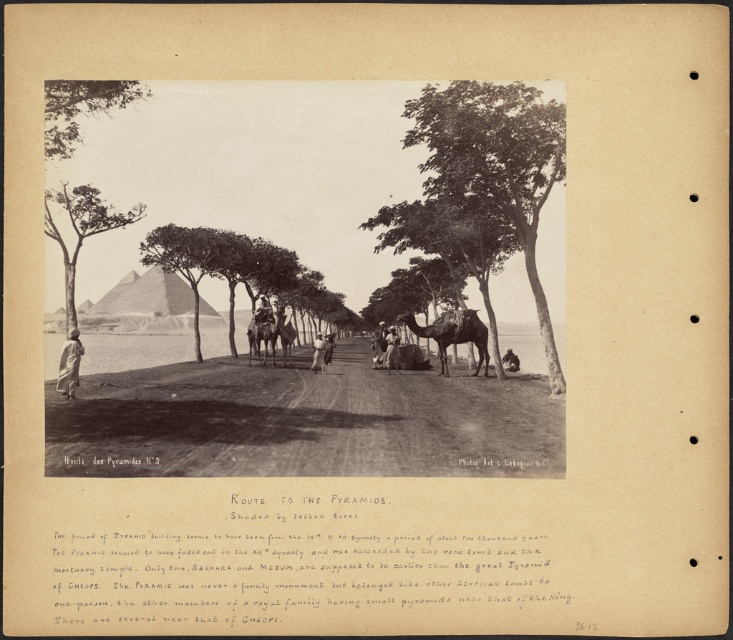
Question: Does smooth bark tree at center appear under dark brown leather camel at center?

Choices:
 (A) yes
 (B) no

Answer: (B)

Question: Observing the image, what is the correct spatial positioning of brown leather horse at center in reference to dark brown leather camel at center?

Choices:
 (A) above
 (B) below

Answer: (A)

Question: Which point is farther to the camera?

Choices:
 (A) brown leather horse at center
 (B) smooth bark tree at center

Answer: (B)

Question: Which of these objects is positioned farthest from the smooth bark tree at center?

Choices:
 (A) green leafy tree at upper left
 (B) green leafy tree at center
 (C) brown leather horse at center

Answer: (A)

Question: Does green leafy tree at upper left have a smaller size compared to green leafy tree at left?

Choices:
 (A) yes
 (B) no

Answer: (A)

Question: Which of the following is the closest to the observer?

Choices:
 (A) (320, 332)
 (B) (292, 336)
 (C) (512, 353)

Answer: (C)